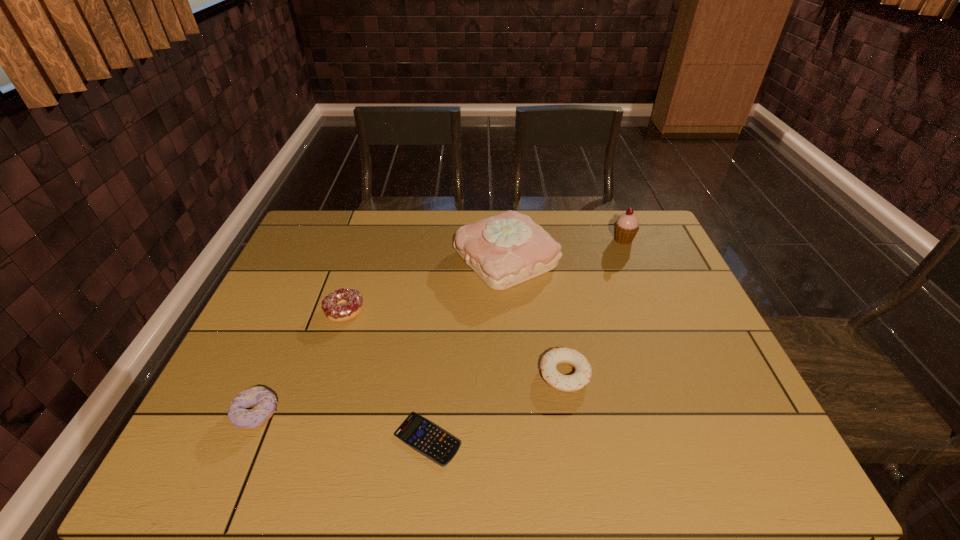
I want to click on vacant position at the near edge of the desktop, so click(x=612, y=467).

You are a GUI agent. You are given a task and a screenshot of the screen. Output one action in this format:
    pyautogui.click(x=<x>, y=<y>)
    Task: Click on the free space at the left edge
    
    Given the screenshot: What is the action you would take?
    pyautogui.click(x=286, y=270)

In order to click on vacant point at the right edge in this screenshot , I will do `click(708, 399)`.

Locate an element on the screen. vacant region at the far left corner is located at coordinates (327, 212).

Identify the location of vacant space at the far right corner. (634, 239).

I want to click on free space at the near right corner of the desktop, so click(x=698, y=449).

Find the location of a particular element. The height and width of the screenshot is (540, 960). vacant point located between the leftmost doughnut and the calculator is located at coordinates (342, 426).

Find the location of a particular element. Image resolution: width=960 pixels, height=540 pixels. free space between the leftmost object and the rightmost doughnut is located at coordinates (411, 394).

Identify the location of vacant space that's between the cupcake and the cake. (564, 249).

Locate an element on the screen. The width and height of the screenshot is (960, 540). free space between the second object from left to right and the rightmost doughnut is located at coordinates 454,342.